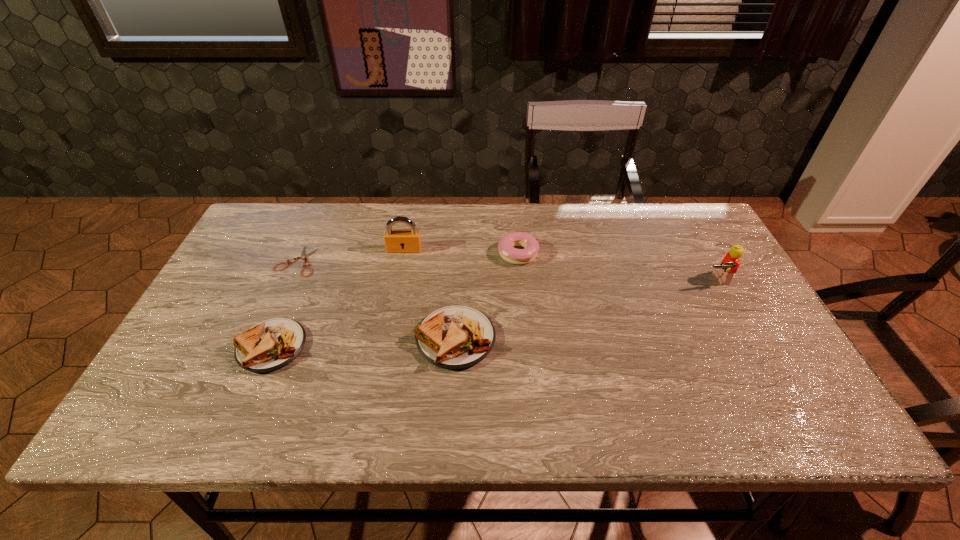
Locate an element on the screen. free space between the padlock and the right sandwich is located at coordinates (430, 294).

The width and height of the screenshot is (960, 540). Identify the location of vacant point located between the left sandwich and the rightmost object. (493, 313).

At what (x,y) coordinates should I click in order to perform the action: click on free spot between the taller sandwich and the left sandwich. Please return your answer as a coordinate pair (x, y). Image resolution: width=960 pixels, height=540 pixels. Looking at the image, I should click on (364, 342).

Identify the location of unoccupied position between the right sandwich and the rightmost object. (585, 309).

The height and width of the screenshot is (540, 960). I want to click on free space that is in between the doughnut and the padlock, so click(461, 252).

What are the coordinates of `blank region between the padlock and the doughnut` in the screenshot? It's located at (461, 252).

Locate an element on the screen. This screenshot has height=540, width=960. free space between the right sandwich and the fifth object from left to right is located at coordinates tap(487, 296).

Locate an element on the screen. This screenshot has width=960, height=540. free space between the padlock and the shorter sandwich is located at coordinates (338, 298).

Locate which object is the second closest to the shorter sandwich. Please provide its 2D coordinates. Your answer should be formatted as a tuple, i.e. [(x, y)], where the tuple contains the x and y coordinates of a point satisfying the conditions above.

[(455, 337)]

Where is `object that can be found as the fourth closest to the shortest object`? The height and width of the screenshot is (540, 960). object that can be found as the fourth closest to the shortest object is located at coordinates (506, 244).